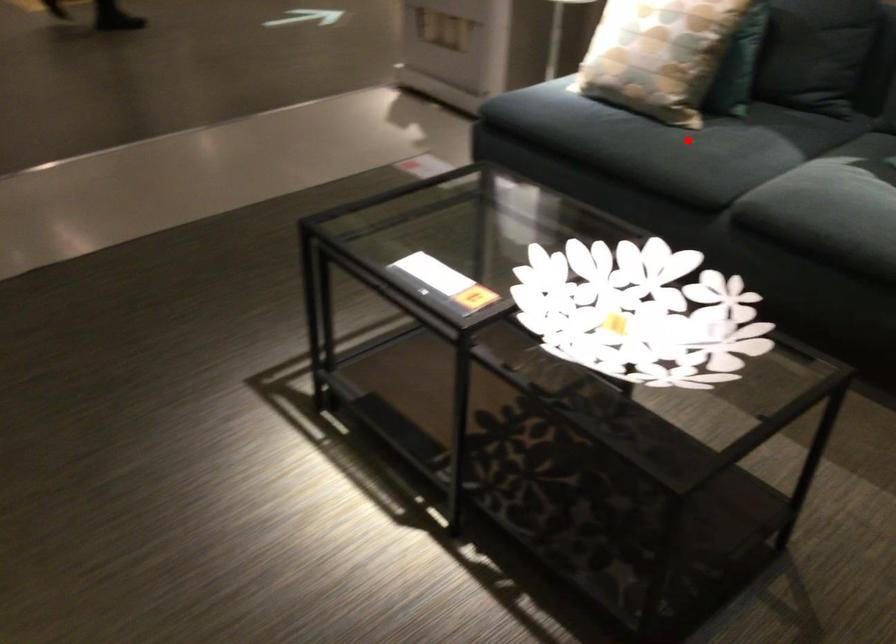
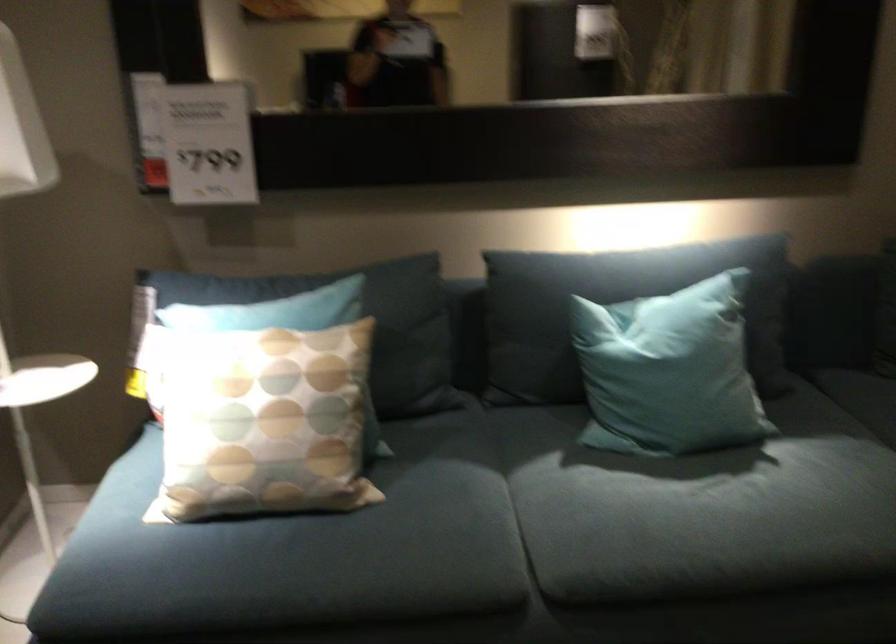
Where in the second image is the point corresponding to the highlighted location from the first image?

(406, 526)